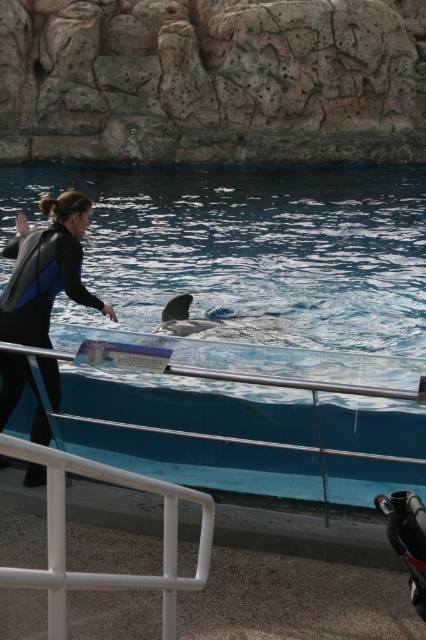
Question: Among these points, which one is farthest from the camera?

Choices:
 (A) (170, 326)
 (B) (137, 476)
 (C) (5, 356)
 (D) (276, 381)

Answer: (A)

Question: Can you confirm if metal/rail at lower center is thinner than white plastic rail at lower left?

Choices:
 (A) no
 (B) yes

Answer: (A)

Question: Where is black matte wetsuit at left located in relation to gray smooth dolphin at center in the image?

Choices:
 (A) below
 (B) above

Answer: (B)

Question: Which point is farther from the camera taking this photo?

Choices:
 (A) (13, 579)
 (B) (342, 432)
 (C) (172, 310)

Answer: (C)

Question: Is metal/rail at lower center further to camera compared to white plastic rail at lower left?

Choices:
 (A) yes
 (B) no

Answer: (A)

Question: Which point is farther to the camera?

Choices:
 (A) (178, 296)
 (B) (14, 317)
 (C) (279, 320)
 (D) (123, 582)

Answer: (A)